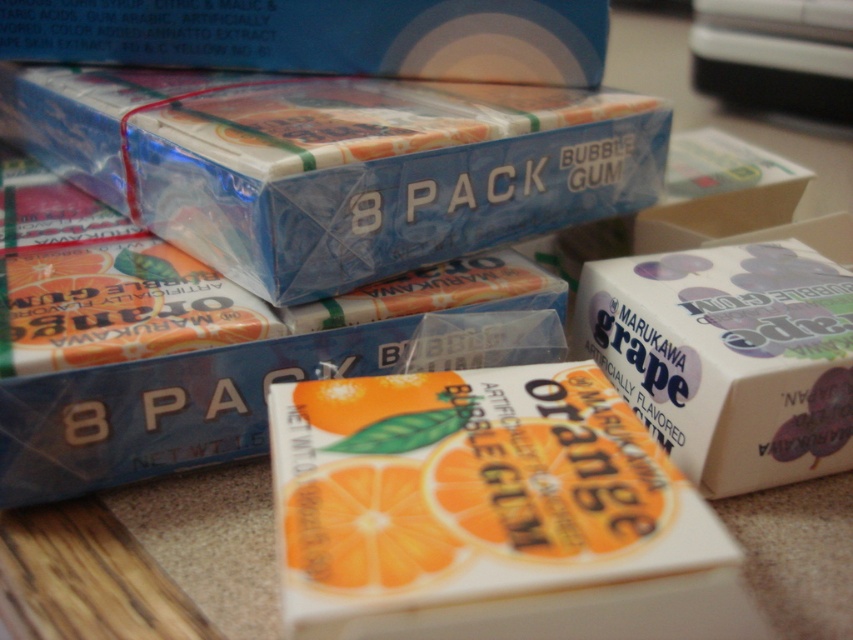
You are a customer at a store and want to buy the matte plastic bubble gum at upper center. The store requires you to specify its exact 2D coordinates to locate it. What are the coordinates?

The coordinates of the matte plastic bubble gum at upper center are at point (321, 36).

In the scene shown: You are organizing a store shelf and need to place the blue glossy bubble gum pack at center and the white matte grape bubble gum at center. Since the shelf has limited space, which one should you place first to maximize shelf usage?

The blue glossy bubble gum pack at center is larger in size than the white matte grape bubble gum at center, so you should place the larger one first to make better use of the shelf space.

You are a customer at a store looking to buy bubble gum. You see two boxes on the counter. The first one is the matte plastic bubble gum at upper center and the second is the orange matte bubble gum at center. Which box is wider?

The matte plastic bubble gum at upper center is wider than the orange matte bubble gum at center.